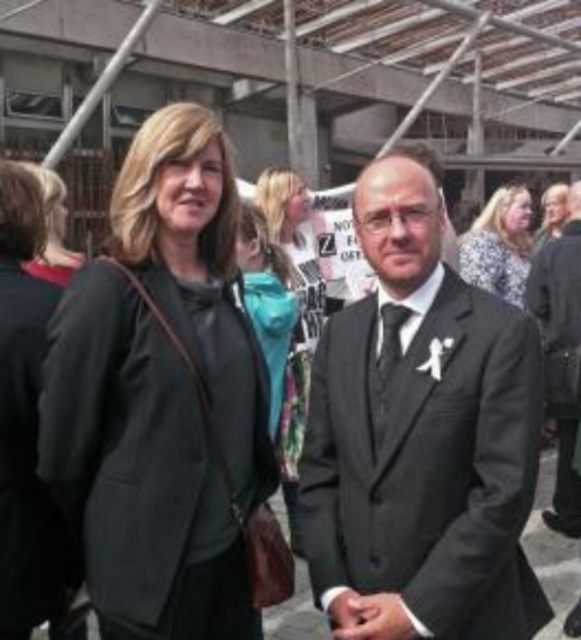
Is matte black suit at center thinner than matte black jacket at upper right?

Correct, matte black suit at center's width is less than matte black jacket at upper right's.

What do you see at coordinates (421, 438) in the screenshot?
I see `matte black suit at center` at bounding box center [421, 438].

Image resolution: width=581 pixels, height=640 pixels. What are the coordinates of `matte black suit at center` in the screenshot? It's located at (x=421, y=438).

Between matte black blazer at center and black suit at center, which one appears on the left side from the viewer's perspective?

matte black blazer at center is more to the left.

Is point (80, 422) more distant than point (554, 342)?

No.

Between point (199, 513) and point (553, 352), which one is positioned behind?

The point (553, 352) is more distant.

Locate an element on the screen. matte black blazer at center is located at coordinates (160, 396).

Is black silk tie at center smaller than matte black jacket at upper right?

Yes, black silk tie at center is smaller than matte black jacket at upper right.

Is point (389, 371) more distant than point (537, 236)?

No, (389, 371) is in front of (537, 236).

Does point (385, 307) come farther from viewer compared to point (541, 228)?

That is False.

At what (x,y) coordinates should I click in order to perform the action: click on black silk tie at center. Please return your answer as a coordinate pair (x, y). The image size is (581, 640). Looking at the image, I should click on (389, 340).